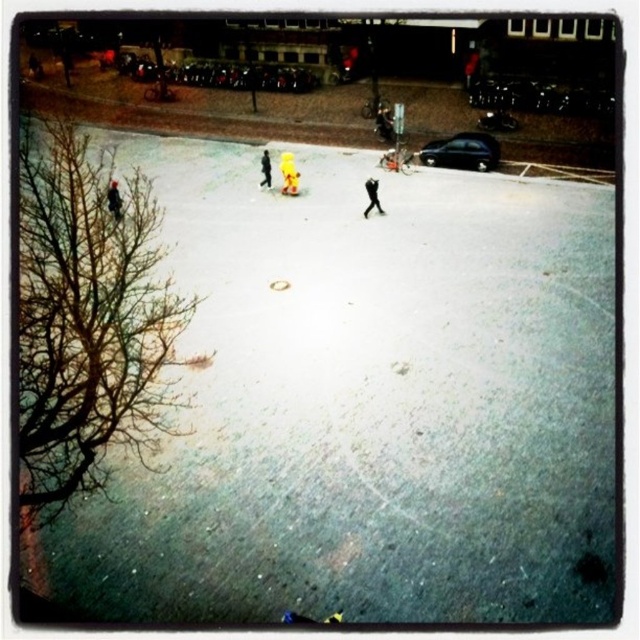
Question: Does yellow matte person at center have a greater width compared to yellow fabric at center?

Choices:
 (A) no
 (B) yes

Answer: (B)

Question: Which of the following is the farthest from the observer?

Choices:
 (A) dark gray jacket at left
 (B) black matte figure at center
 (C) yellow matte person at center

Answer: (C)

Question: Which object is closer to the camera taking this photo?

Choices:
 (A) dark gray jacket at left
 (B) yellow fabric at center
 (C) yellow matte person at center
 (D) black matte figure at center

Answer: (A)

Question: Which point is farther from the camera taking this photo?

Choices:
 (A) (268, 157)
 (B) (285, 192)

Answer: (A)

Question: Can you confirm if yellow matte person at center is wider than dark gray jacket at left?

Choices:
 (A) yes
 (B) no

Answer: (B)

Question: Where is black matte figure at center located in relation to dark gray jacket at left in the image?

Choices:
 (A) above
 (B) below

Answer: (A)